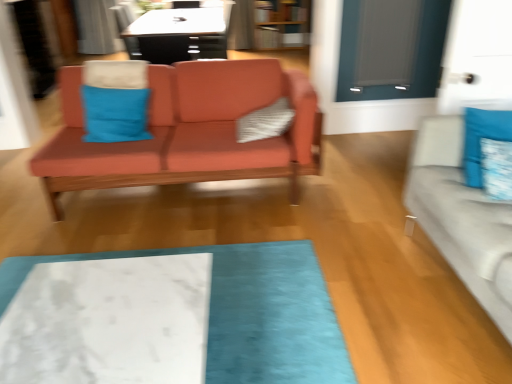
Question: From the image's perspective, is white marble mat at lower center above or below blue fabric pillow at right, the 3th pillow when ordered from left to right?

Choices:
 (A) above
 (B) below

Answer: (B)

Question: Does point (261, 263) appear closer or farther from the camera than point (489, 195)?

Choices:
 (A) farther
 (B) closer

Answer: (A)

Question: Considering the real-world distances, which object is farthest from the matte coral couch at center, which is the first studio couch from left to right?

Choices:
 (A) white marble mat at lower center
 (B) matte gray glass door at upper right
 (C) light gray fabric couch at right, acting as the first studio couch starting from the right
 (D) white textured pillow at center, the 3th pillow in the right-to-left sequence
 (E) blue fabric pillow at right, arranged as the first pillow when viewed from the right

Answer: (E)

Question: Which object is the closest to the blue fabric pillow at right, the 2th pillow in the right-to-left sequence?

Choices:
 (A) wooden bookshelf at upper center
 (B) matte coral couch at center, the 1th studio couch positioned from the back
 (C) white textured pillow at center, the 3th pillow in the right-to-left sequence
 (D) blue fabric pillow at center, which ranks as the 4th pillow in right-to-left order
 (E) blue fabric pillow at right, which is the 4th pillow from left to right

Answer: (E)